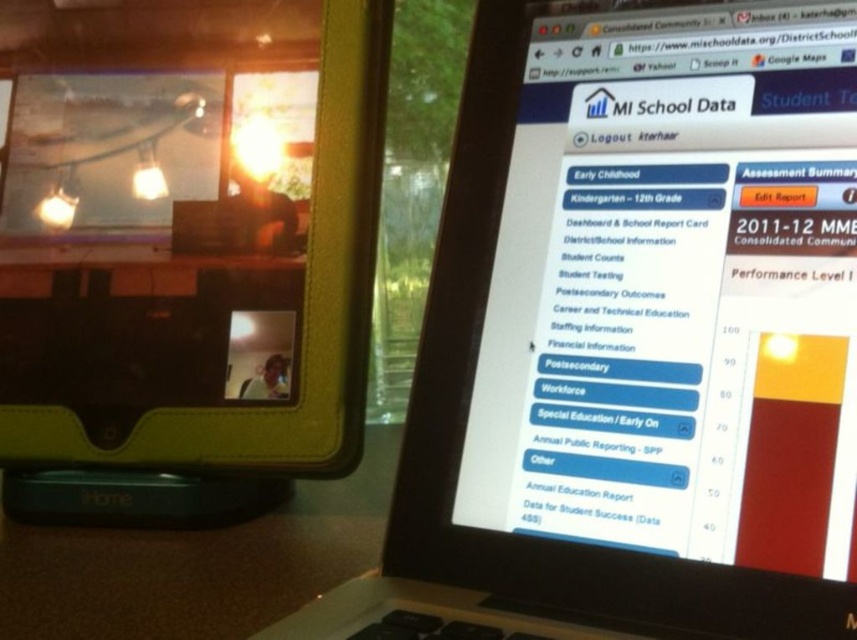
Which is above, black matte laptop at upper right or matte black tablet at upper left?

matte black tablet at upper left is higher up.

Does black matte laptop at upper right have a greater height compared to matte black tablet at upper left?

Correct, black matte laptop at upper right is much taller as matte black tablet at upper left.

Where is `black matte laptop at upper right`? black matte laptop at upper right is located at coordinates (633, 337).